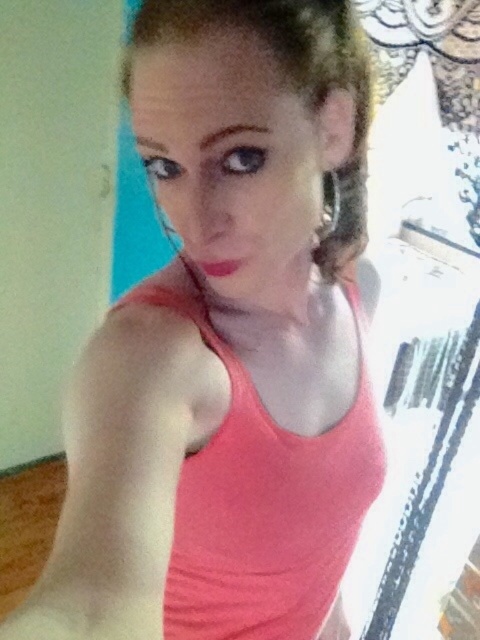
Can you confirm if matte coral tank top at center is positioned to the left of matte pink lipstick at center?

In fact, matte coral tank top at center is to the right of matte pink lipstick at center.

Is matte coral tank top at center positioned behind matte pink lipstick at center?

Yes, matte coral tank top at center is further from the viewer.

Image resolution: width=480 pixels, height=640 pixels. I want to click on matte coral tank top at center, so click(262, 502).